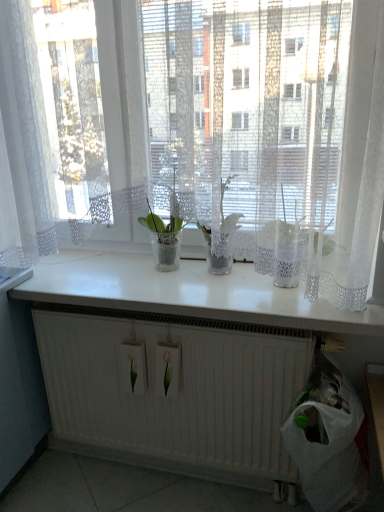
Locate an element on the screen. This screenshot has height=512, width=384. vacant region under translucent glass vase at center (from a real-world perspective) is located at coordinates (217, 276).